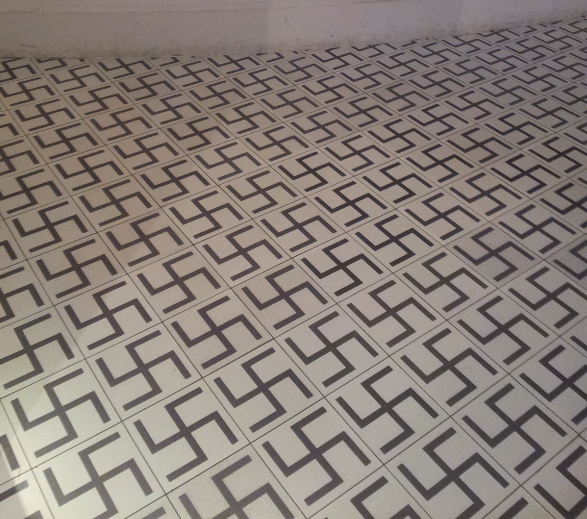
You are a GUI agent. You are given a task and a screenshot of the screen. Output one action in this format:
    pyautogui.click(x=<x>, y=<y>)
    Task: Click on the tile
    The height and width of the screenshot is (519, 587).
    Given the screenshot: What is the action you would take?
    pyautogui.click(x=545, y=120)